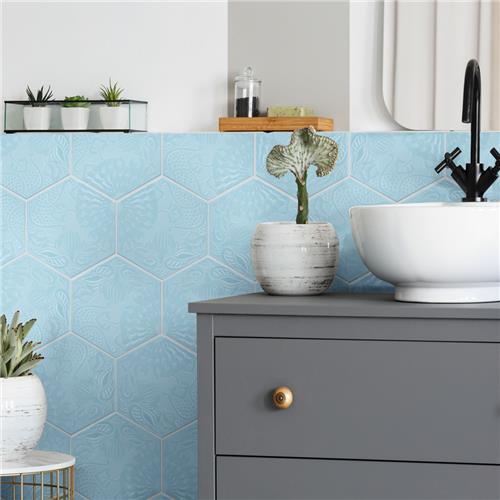
At what (x,y) coordinates should I click in order to perform the action: click on cold water handle. Please return your answer as a coordinate pair (x, y). Looking at the image, I should click on (496, 164).